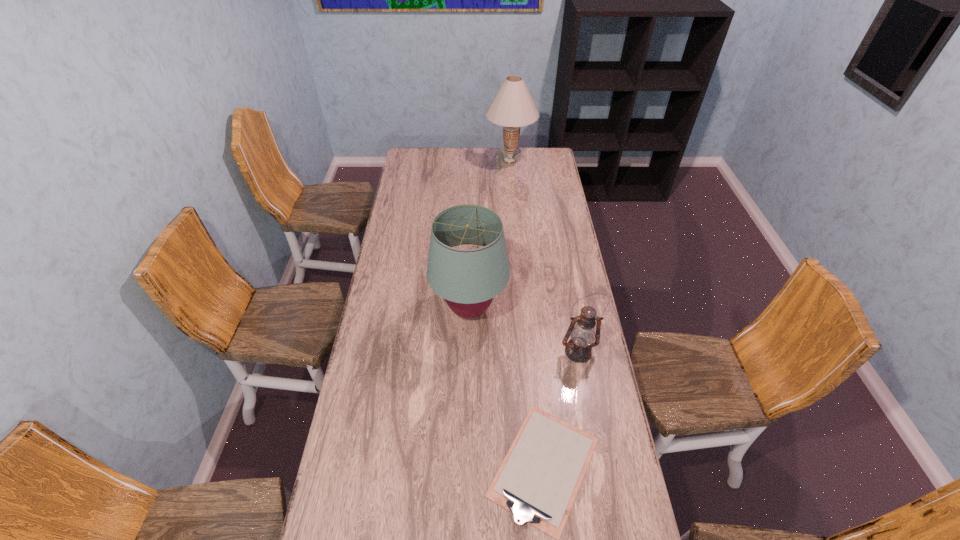
Find the location of a particular element. This screenshot has height=540, width=960. object located at the far right corner is located at coordinates (513, 107).

I want to click on vacant region at the far edge of the desktop, so click(451, 167).

This screenshot has height=540, width=960. In the image, there is a desktop. In order to click on vacant region at the left edge in this screenshot , I will do `click(408, 199)`.

Identify the location of vacant region at the right edge. (543, 176).

You are a GUI agent. You are given a task and a screenshot of the screen. Output one action in this format:
    pyautogui.click(x=<x>, y=<y>)
    Task: Click on the vacant region between the farthest object and the oil lamp
    The height and width of the screenshot is (540, 960).
    Given the screenshot: What is the action you would take?
    pyautogui.click(x=544, y=256)

You are a GUI agent. You are given a task and a screenshot of the screen. Output one action in this format:
    pyautogui.click(x=<x>, y=<y>)
    Task: Click on the closest object relative to the third tallest object
    
    Given the screenshot: What is the action you would take?
    pyautogui.click(x=539, y=478)

Find the location of a particular element. the third closest object to the clipboard is located at coordinates (513, 107).